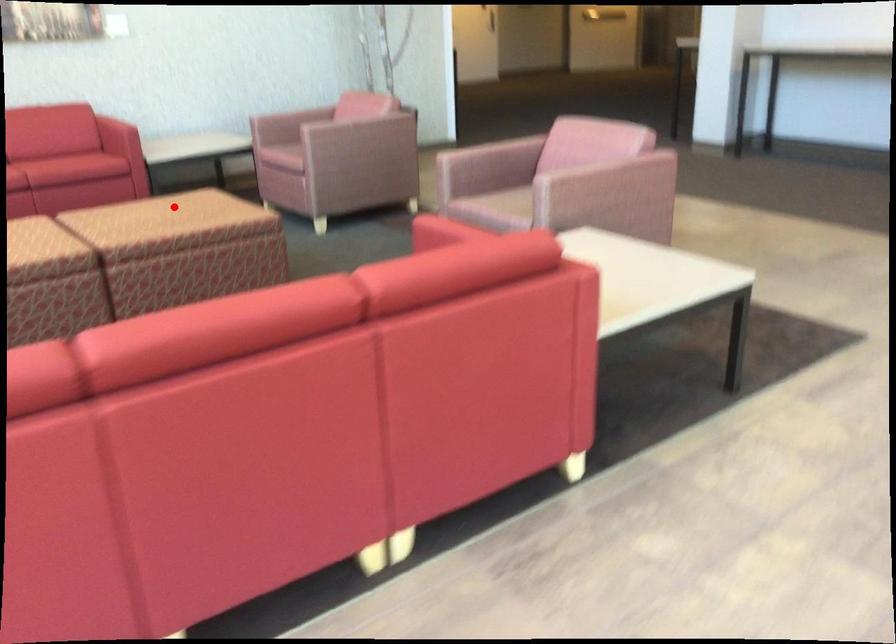
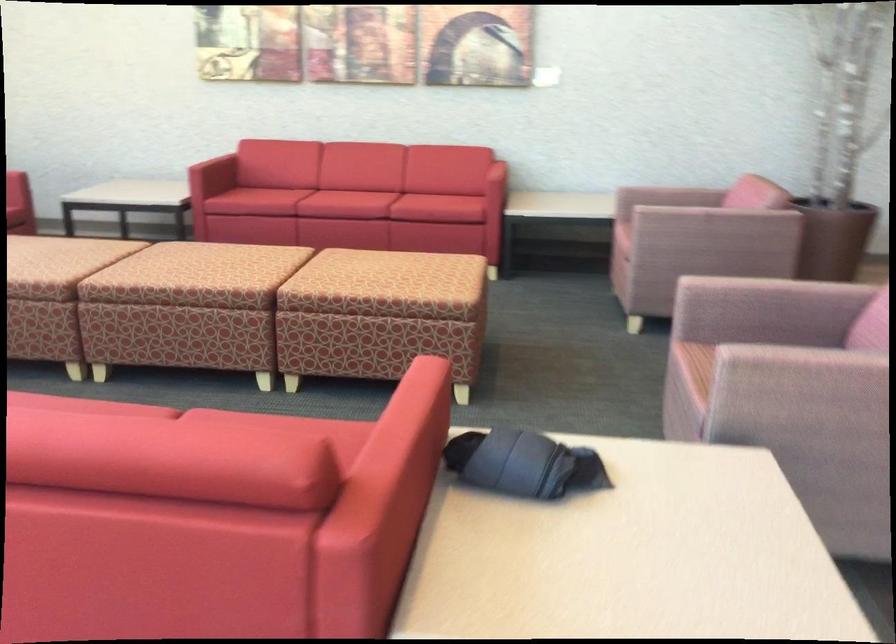
Locate, in the second image, the point that corresponds to the highlighted location in the first image.

(385, 270)